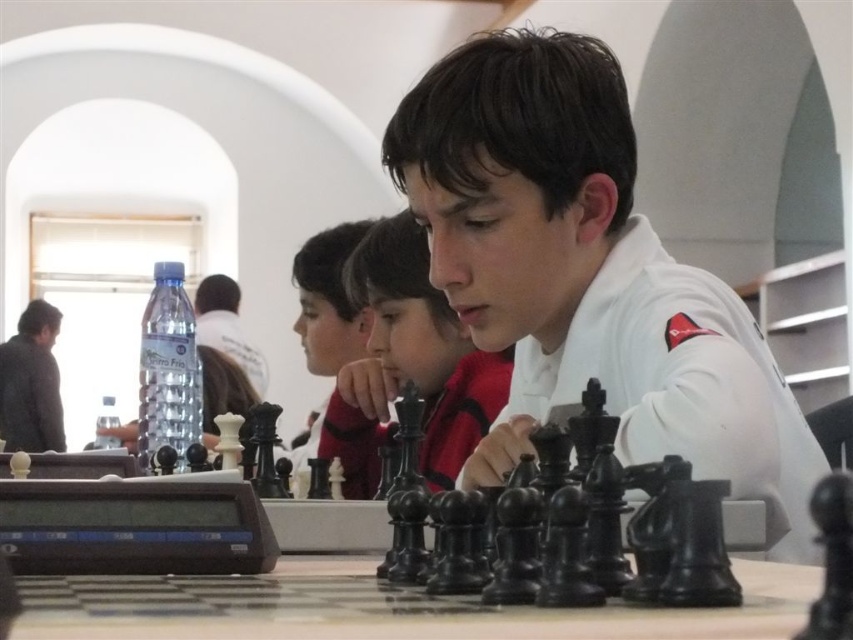
Which is above, matte black chess piece at center or clear plastic bottle at center?

clear plastic bottle at center is higher up.

Does point (338, 352) come farther from viewer compared to point (238, 300)?

No.

Locate an element on the screen. matte black chess piece at center is located at coordinates (328, 300).

Who is higher up, dark gray sweater at left or clear plastic bottle at center?

clear plastic bottle at center

Is point (0, 362) behind point (225, 326)?

No, it is in front of (225, 326).

Does point (30, 376) come closer to viewer compared to point (228, 305)?

Yes, it is in front of point (228, 305).

Where is `dark gray sweater at left`? The image size is (853, 640). dark gray sweater at left is located at coordinates (32, 384).

Who is lower down, white matte shirt at center or matte black chess piece at center?

white matte shirt at center is lower down.

Identify the location of white matte shirt at center. (408, 364).

Who is more distant from viewer, (486, 401) or (326, 355)?

Positioned behind is point (326, 355).

Identify the location of white matte shirt at center. (408, 364).